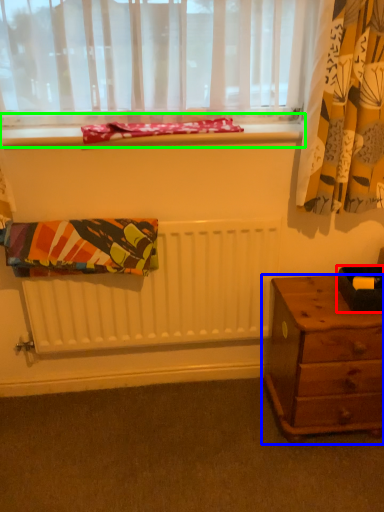
Question: Estimate the real-world distances between objects in this image. Which object is closer to box (highlighted by a red box), nightstand (highlighted by a blue box) or window sill (highlighted by a green box)?

Choices:
 (A) nightstand
 (B) window sill

Answer: (A)